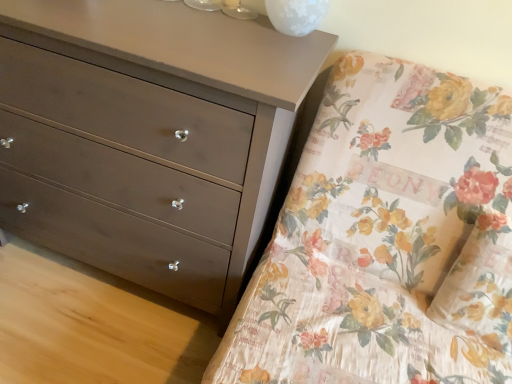
Image resolution: width=512 pixels, height=384 pixels. What are the coordinates of `white frosted glass at upper center` in the screenshot? It's located at (296, 15).

You are a GUI agent. You are given a task and a screenshot of the screen. Output one action in this format:
    pyautogui.click(x=<x>, y=<y>)
    Task: Click on the floral fabric bed at upper right
    
    Given the screenshot: What is the action you would take?
    pyautogui.click(x=387, y=239)

You are a GUI agent. You are given a task and a screenshot of the screen. Output one action in this format:
    pyautogui.click(x=<x>, y=<y>)
    Task: Click on the floral fabric pillow at right
    This screenshot has width=512, height=384.
    Given the screenshot: What is the action you would take?
    pyautogui.click(x=480, y=285)

The image size is (512, 384). I want to click on matte brown dresser at left, so click(x=161, y=119).

Could you tell me if white frosted glass at upper center is turned towards matte brown dresser at left?

No, white frosted glass at upper center is not turned towards matte brown dresser at left.

Between white frosted glass at upper center and matte brown dresser at left, which one has smaller size?

Smaller between the two is white frosted glass at upper center.

Between point (288, 31) and point (170, 17), which one is positioned behind?

Positioned behind is point (170, 17).

What are the coordinates of `glass vase behind the matte brown dresser at left` in the screenshot? It's located at (296, 15).

Consider the image. Considering the sizes of objects floral fabric pillow at right and white frosted glass at upper center in the image provided, who is wider, floral fabric pillow at right or white frosted glass at upper center?

white frosted glass at upper center.

Would you say floral fabric pillow at right is to the left or to the right of white frosted glass at upper center in the picture?

From the image, it's evident that floral fabric pillow at right is to the right of white frosted glass at upper center.

Considering the sizes of objects floral fabric pillow at right and white frosted glass at upper center in the image provided, who is bigger, floral fabric pillow at right or white frosted glass at upper center?

Bigger between the two is floral fabric pillow at right.

Is floral fabric pillow at right aimed at white frosted glass at upper center?

No, floral fabric pillow at right is not aimed at white frosted glass at upper center.

Is white frosted glass at upper center aimed at floral fabric pillow at right?

No.

Does white frosted glass at upper center appear on the left side of floral fabric pillow at right?

Yes.

Considering the relative sizes of white frosted glass at upper center and floral fabric pillow at right in the image provided, is white frosted glass at upper center wider than floral fabric pillow at right?

Yes, white frosted glass at upper center is wider than floral fabric pillow at right.

Do you think floral fabric pillow at right is within matte brown dresser at left, or outside of it?

floral fabric pillow at right lies outside matte brown dresser at left.

From a real-world perspective, which object stands above the other?

floral fabric pillow at right is physically above.

Is floral fabric pillow at right behind matte brown dresser at left?

Yes, it is behind matte brown dresser at left.

Consider the image. Between floral fabric pillow at right and matte brown dresser at left, which one has larger width?

Wider between the two is matte brown dresser at left.

Is the surface of floral fabric pillow at right in direct contact with floral fabric bed at upper right?

No, floral fabric pillow at right is not beside floral fabric bed at upper right.

How different are the orientations of floral fabric pillow at right and floral fabric bed at upper right in degrees?

4.3 degrees separate the facing orientations of floral fabric pillow at right and floral fabric bed at upper right.

From a real-world perspective, which is physically below, floral fabric pillow at right or floral fabric bed at upper right?

floral fabric bed at upper right, from a real-world perspective.

Which object is positioned more to the left, floral fabric pillow at right or floral fabric bed at upper right?

floral fabric bed at upper right is more to the left.

From the image's perspective, who appears lower, white frosted glass at upper center or floral fabric bed at upper right?

floral fabric bed at upper right, from the image's perspective.

From a real-world perspective, is white frosted glass at upper center physically above floral fabric bed at upper right?

Correct, in the physical world, white frosted glass at upper center is higher than floral fabric bed at upper right.

In the scene shown: Is white frosted glass at upper center looking in the opposite direction of floral fabric bed at upper right?

white frosted glass at upper center is not turned away from floral fabric bed at upper right.

Consider the image. Is floral fabric bed at upper right positioned far away from matte brown dresser at left?

No, floral fabric bed at upper right is not far from matte brown dresser at left.

Is floral fabric bed at upper right aimed at matte brown dresser at left?

No, floral fabric bed at upper right does not turn towards matte brown dresser at left.

Is floral fabric bed at upper right outside of matte brown dresser at left?

Yes.

The image size is (512, 384). Identify the location of the chest of drawers beneath the white frosted glass at upper center (from a real-world perspective). (161, 119).

Image resolution: width=512 pixels, height=384 pixels. Find the location of `pillow below the white frosted glass at upper center (from the image's perspective)`. pillow below the white frosted glass at upper center (from the image's perspective) is located at coordinates (480, 285).

From the image, which object appears to be nearer to matte brown dresser at left, white frosted glass at upper center or floral fabric bed at upper right?

Among the two, floral fabric bed at upper right is located nearer to matte brown dresser at left.

From the image, which object appears to be nearer to white frosted glass at upper center, floral fabric bed at upper right or floral fabric pillow at right?

floral fabric bed at upper right lies closer to white frosted glass at upper center than the other object.

When comparing their distances from floral fabric bed at upper right, does floral fabric pillow at right or white frosted glass at upper center seem closer?

floral fabric pillow at right.

Looking at the image, which one is located closer to floral fabric pillow at right, white frosted glass at upper center or matte brown dresser at left?

Among the two, white frosted glass at upper center is located nearer to floral fabric pillow at right.

Looking at the image, which one is located further to floral fabric pillow at right, white frosted glass at upper center or floral fabric bed at upper right?

Among the two, white frosted glass at upper center is located further to floral fabric pillow at right.

Estimate the real-world distances between objects in this image. Which object is further from floral fabric bed at upper right, floral fabric pillow at right or matte brown dresser at left?

matte brown dresser at left is further to floral fabric bed at upper right.

Based on the photo, from the image, which object appears to be farther from floral fabric pillow at right, floral fabric bed at upper right or matte brown dresser at left?

Based on the image, matte brown dresser at left appears to be further to floral fabric pillow at right.

When comparing their distances from matte brown dresser at left, does floral fabric pillow at right or floral fabric bed at upper right seem closer?

The object closer to matte brown dresser at left is floral fabric bed at upper right.

Image resolution: width=512 pixels, height=384 pixels. Identify the location of the chest of drawers between white frosted glass at upper center and floral fabric bed at upper right vertically. (161, 119).

The image size is (512, 384). Identify the location of glass vase situated between matte brown dresser at left and floral fabric pillow at right from left to right. (296, 15).

At what (x,y) coordinates should I click in order to perform the action: click on pillow between white frosted glass at upper center and floral fabric bed at upper right vertically. Please return your answer as a coordinate pair (x, y). This screenshot has width=512, height=384. Looking at the image, I should click on (480, 285).

Identify the location of mattress situated between matte brown dresser at left and floral fabric pillow at right from left to right. This screenshot has width=512, height=384. (387, 239).